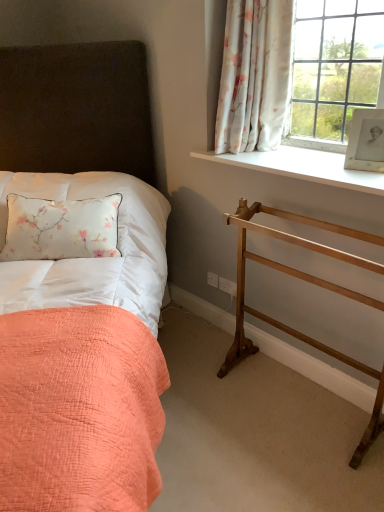
Question: Does floral fabric curtain at upper right appear on the left side of white quilted fabric at upper left?

Choices:
 (A) no
 (B) yes

Answer: (A)

Question: From a real-world perspective, is floral fabric curtain at upper right located beneath white quilted fabric at upper left?

Choices:
 (A) no
 (B) yes

Answer: (A)

Question: Is floral fabric curtain at upper right taller than white quilted fabric at upper left?

Choices:
 (A) yes
 (B) no

Answer: (A)

Question: Does floral fabric curtain at upper right have a lesser width compared to white quilted fabric at upper left?

Choices:
 (A) no
 (B) yes

Answer: (B)

Question: Is floral fabric curtain at upper right beside white quilted fabric at upper left?

Choices:
 (A) yes
 (B) no

Answer: (B)

Question: From a real-world perspective, is floral fabric curtain at upper right physically above white quilted fabric at upper left?

Choices:
 (A) yes
 (B) no

Answer: (A)

Question: From a real-world perspective, is white smooth window sill at upper right physically below matte fabric bed at left?

Choices:
 (A) no
 (B) yes

Answer: (A)

Question: Is white smooth window sill at upper right outside matte fabric bed at left?

Choices:
 (A) no
 (B) yes

Answer: (B)

Question: Would you say white smooth window sill at upper right is a long distance from matte fabric bed at left?

Choices:
 (A) no
 (B) yes

Answer: (A)

Question: From the image's perspective, is white smooth window sill at upper right over matte fabric bed at left?

Choices:
 (A) yes
 (B) no

Answer: (A)

Question: Considering the relative positions of white smooth window sill at upper right and matte fabric bed at left in the image provided, is white smooth window sill at upper right to the left of matte fabric bed at left from the viewer's perspective?

Choices:
 (A) no
 (B) yes

Answer: (A)

Question: Does white smooth window sill at upper right have a greater height compared to matte fabric bed at left?

Choices:
 (A) no
 (B) yes

Answer: (A)

Question: Considering the relative sizes of floral fabric curtain at upper right and wooden balustrade at right in the image provided, is floral fabric curtain at upper right wider than wooden balustrade at right?

Choices:
 (A) no
 (B) yes

Answer: (A)